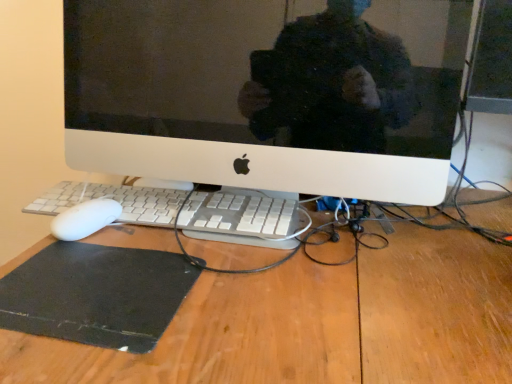
You are a GUI agent. You are given a task and a screenshot of the screen. Output one action in this format:
    pyautogui.click(x=<x>, y=<y>)
    Task: Click on the blank space situated above wooden desk at center (from a real-world perspective)
    
    Given the screenshot: What is the action you would take?
    pyautogui.click(x=315, y=261)